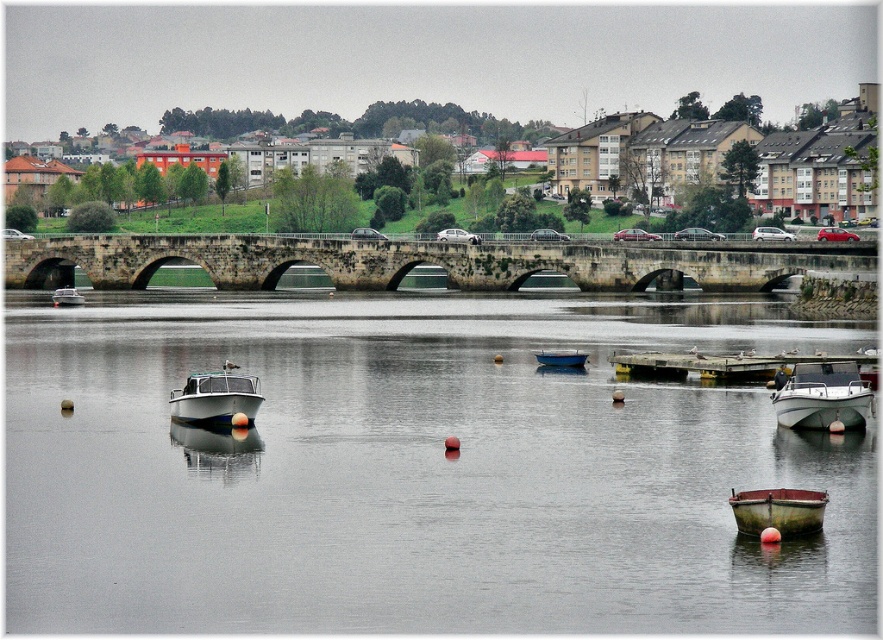
Question: Is the position of white glossy boat at lower right less distant than that of rusty wooden boat at lower right?

Choices:
 (A) yes
 (B) no

Answer: (B)

Question: Which is nearer to the stone bridge at center?

Choices:
 (A) smooth gray water at center
 (B) white glossy boat at lower right
 (C) rusty wooden boat at lower right

Answer: (A)

Question: Does white glossy boat at center have a lesser width compared to rusty wooden boat at lower right?

Choices:
 (A) no
 (B) yes

Answer: (A)

Question: Estimate the real-world distances between objects in this image. Which object is farther from the stone bridge at center?

Choices:
 (A) rusty wooden boat at lower right
 (B) blue matte boat at center
 (C) white glossy boat at center
 (D) smooth gray water at center

Answer: (A)

Question: Which object appears closest to the camera in this image?

Choices:
 (A) rusty wooden boat at lower right
 (B) stone bridge at center
 (C) white glossy boat at lower right

Answer: (A)

Question: Is stone bridge at center positioned at the back of white glossy boat at center?

Choices:
 (A) yes
 (B) no

Answer: (A)